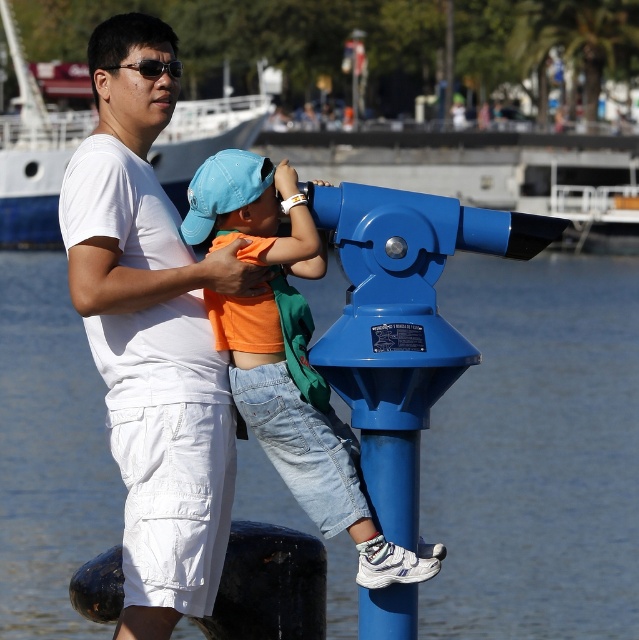
You are a photographer trying to capture a photo of the white cotton shirt at upper left and the matte black sunglasses at upper left. You need to ensure both are in focus. If your camera has a depth of field that can sharply focus objects within a 4 meter range, will both items be in focus?

The white cotton shirt at upper left and matte black sunglasses at upper left are 4.25 meters apart. Since the distance between them exceeds the camera sensor depth of field range of 4 meters, both items may not be in focus simultaneously.

You are standing at the waterfront and want to take a photo of the telescope. You notice two points marked in the scene. Point A is at coordinates point (583, 365) and Point B is at coordinates point (226, 304). Which point is closer to your camera position?

Point B at coordinates point (226, 304) is closer to the camera position because it is less further than point (583, 365).

You are standing at the point marked as point (535, 452) in the image. What object is located exactly at this point?

The blue plastic water at lower center is located exactly at point (535, 452).